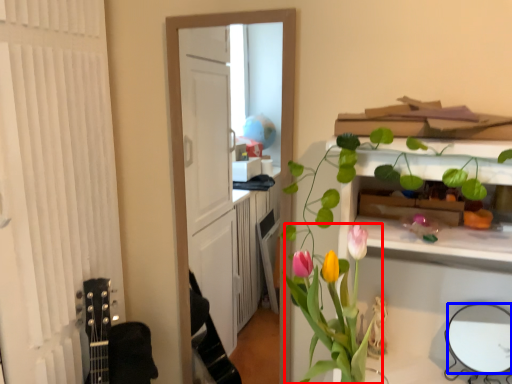
Question: Which point is further to the camera, floral arrangement (highlighted by a red box) or mirror (highlighted by a blue box)?

Choices:
 (A) floral arrangement
 (B) mirror

Answer: (B)